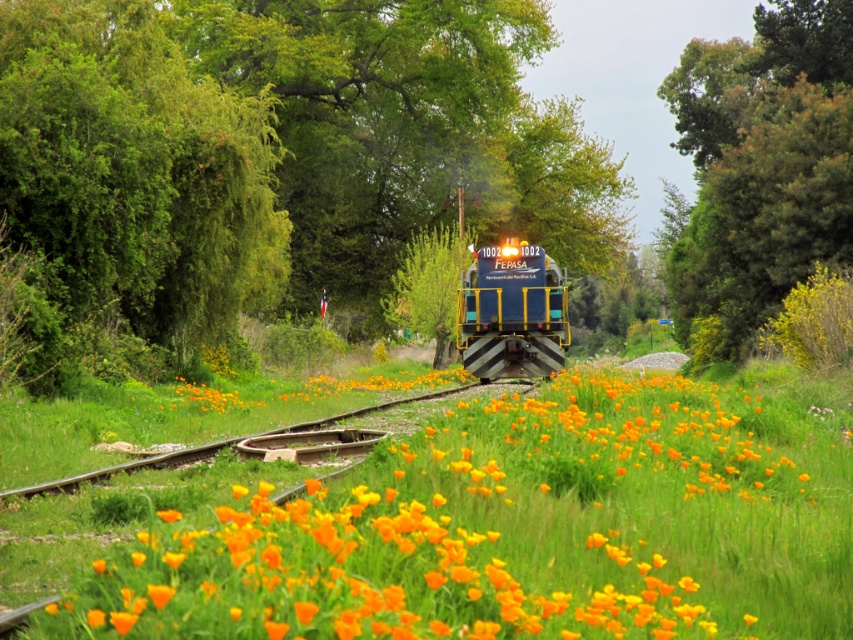
Question: Which point is farther from the camera taking this photo?

Choices:
 (A) 463,312
 (B) 761,77
 (C) 376,387

Answer: (B)

Question: Which of the following is the farthest from the observer?

Choices:
 (A) orange matte flower at center
 (B) green leafy tree at center
 (C) green leafy tree at upper right
 (D) blue metallic train at center

Answer: (C)

Question: Which object appears closest to the camera in this image?

Choices:
 (A) orange matte flower at center
 (B) green leafy tree at center
 (C) blue metallic train at center

Answer: (B)

Question: Does green leafy tree at center have a smaller size compared to orange matte flower at center?

Choices:
 (A) yes
 (B) no

Answer: (B)

Question: Is blue metallic train at center thinner than orange matte flower at center?

Choices:
 (A) no
 (B) yes

Answer: (B)

Question: Does green leafy tree at center have a greater width compared to green leafy tree at upper right?

Choices:
 (A) no
 (B) yes

Answer: (B)